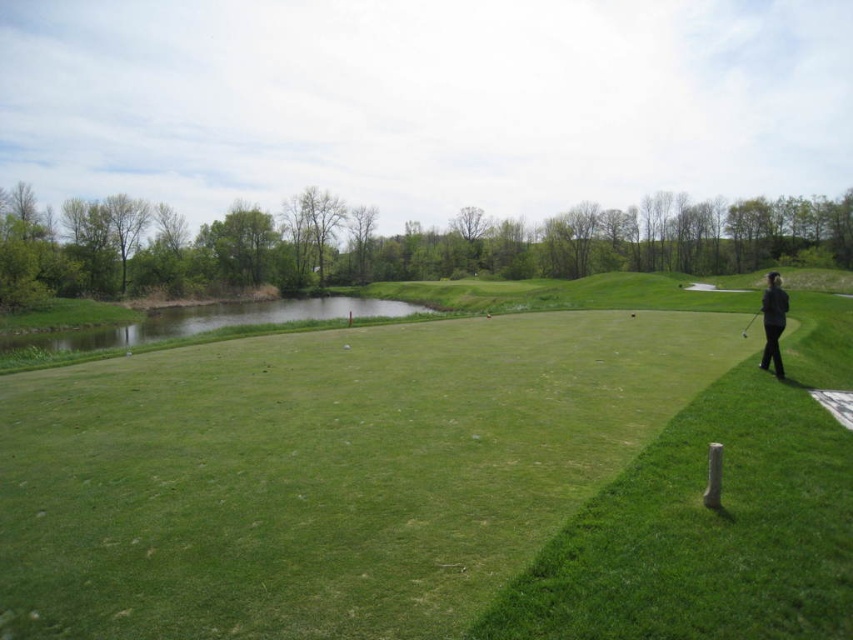
You are a golfer standing on the right side of the frame, holding a golf club. You want to hit a golf ball to the point marked at coordinates (438, 481). According to the scene description, what is the nature of the terrain where the point is located?

The point at coordinates (438, 481) is located on the green grassy golf course at center, which is a well maintained area suitable for putting.

You are a golf ball on the putting green. You want to roll towards the water in the middle ground. Which object, the black fabric person at right or the metallic silver golf club at right, is taller and might block your path?

The black fabric person at right is much taller than the metallic silver golf club at right, so it might block your path.

You are a golfer trying to judge the distance between your position and the golf club you dropped. Based on the scene, can you tell if the black fabric person at right is closer to you than the metallic silver golf club at right?

The black fabric person at right is bigger than the metallic silver golf club at right, which suggests the person is closer to you since objects closer in distance appear larger.